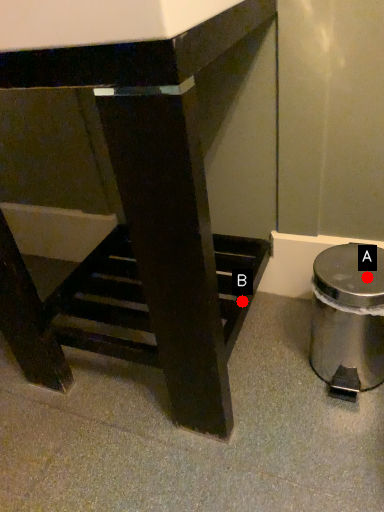
Question: Two points are circled on the image, labeled by A and B beside each circle. Which point is farther to the camera?

Choices:
 (A) A is further
 (B) B is further

Answer: (B)